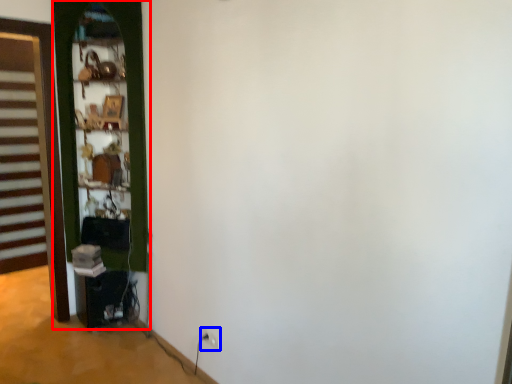
Question: Which object is closer to the camera taking this photo, door (highlighted by a red box) or electric outlet (highlighted by a blue box)?

Choices:
 (A) door
 (B) electric outlet

Answer: (B)